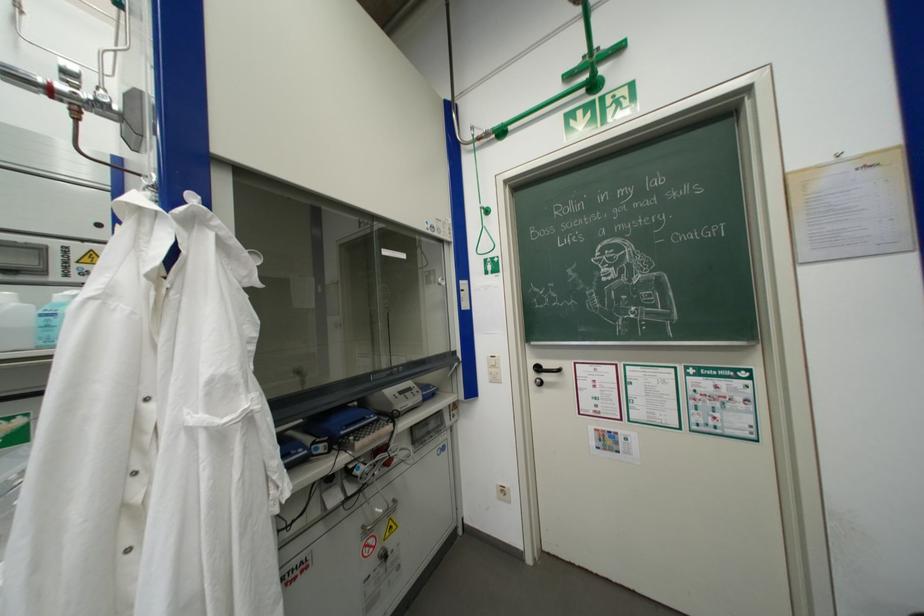
Describe the element at coordinates (387, 461) in the screenshot. I see `the red cabinet knob` at that location.